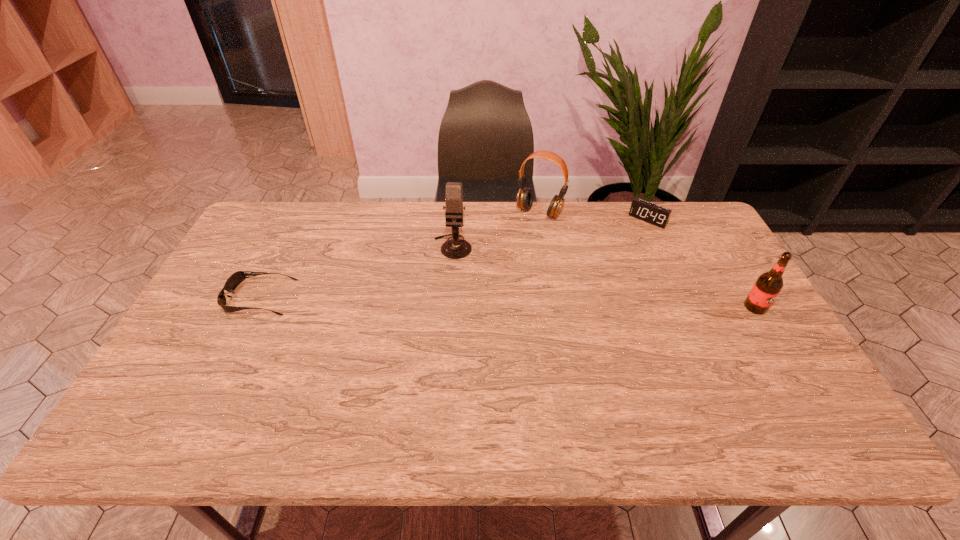
Identify the location of microphone present at the far edge. (455, 248).

The image size is (960, 540). I want to click on alarm clock that is at the far edge, so click(x=651, y=213).

You are a GUI agent. You are given a task and a screenshot of the screen. Output one action in this format:
    pyautogui.click(x=<x>, y=<y>)
    Task: Click on the headset positioned at the far edge
    
    Given the screenshot: What is the action you would take?
    pyautogui.click(x=525, y=196)

Image resolution: width=960 pixels, height=540 pixels. Find the location of `object at the left edge`. object at the left edge is located at coordinates [234, 280].

At what (x,y) coordinates should I click in order to perform the action: click on root beer that is positioned at the right edge. Please return your answer as a coordinate pair (x, y). Looking at the image, I should click on (768, 285).

Where is `alarm clock at the right edge`? The width and height of the screenshot is (960, 540). alarm clock at the right edge is located at coordinates (651, 213).

This screenshot has height=540, width=960. What are the coordinates of `object that is at the far right corner` in the screenshot? It's located at tap(651, 213).

Identify the location of blank space at the far edge. The image size is (960, 540). (645, 239).

Where is `vacant space at the near edge of the desktop`? vacant space at the near edge of the desktop is located at coordinates (299, 387).

Find the location of a particular element. Image resolution: width=960 pixels, height=540 pixels. free region at the right edge of the desktop is located at coordinates (754, 325).